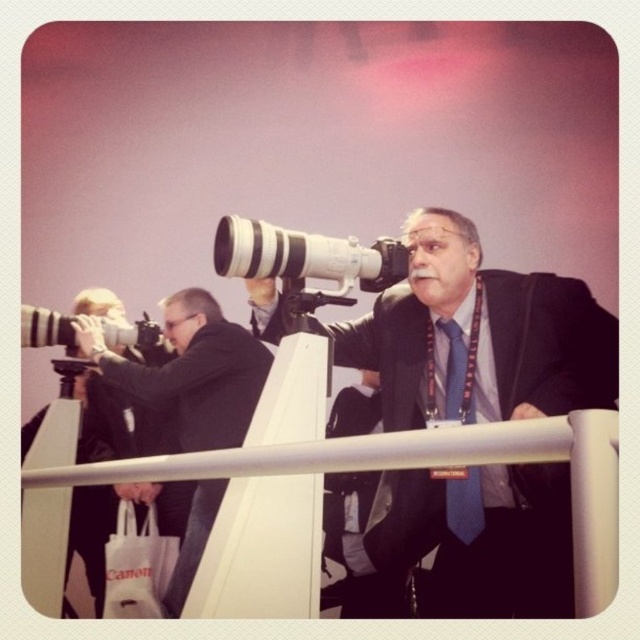
Consider the image. You are standing in the scene and want to place a small tripod for your camera. The tripod requires a flat surface that is at least 0.5 meters away from the white metal rail at center. Is there enough space available for the tripod?

The white metal rail at center is located at point [426,467]. Since the tripod requires a flat surface at least 0.5 meters away from this point, the available space depends on the total dimensions of the scene. However, without specific measurements of the scene area, it is impossible to confirm if there is sufficient space. Please check the layout for an appropriate spot.